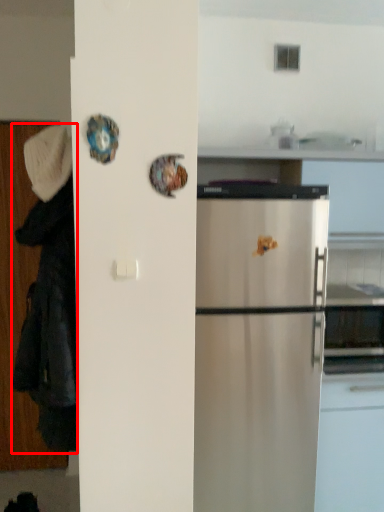
Question: Observing the image, what is the correct spatial positioning of couple (annotated by the red box) in reference to hat?

Choices:
 (A) left
 (B) right

Answer: (A)